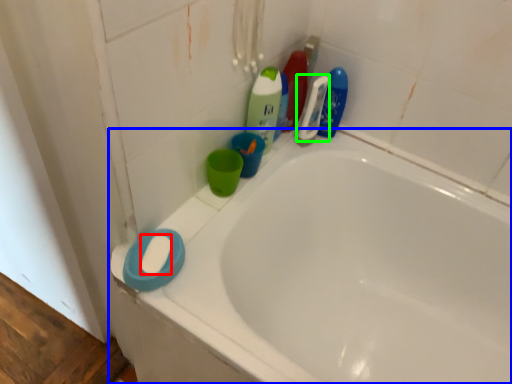
Question: Estimate the real-world distances between objects in this image. Which object is farther from soap (highlighted by a red box), bathtub (highlighted by a blue box) or cleaning product (highlighted by a green box)?

Choices:
 (A) bathtub
 (B) cleaning product

Answer: (B)